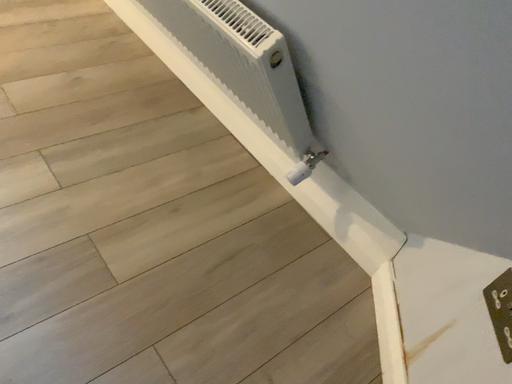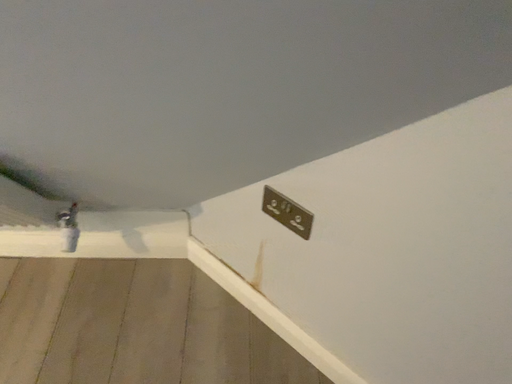
Question: How did the camera likely rotate when shooting the video?

Choices:
 (A) rotated left
 (B) rotated right

Answer: (B)